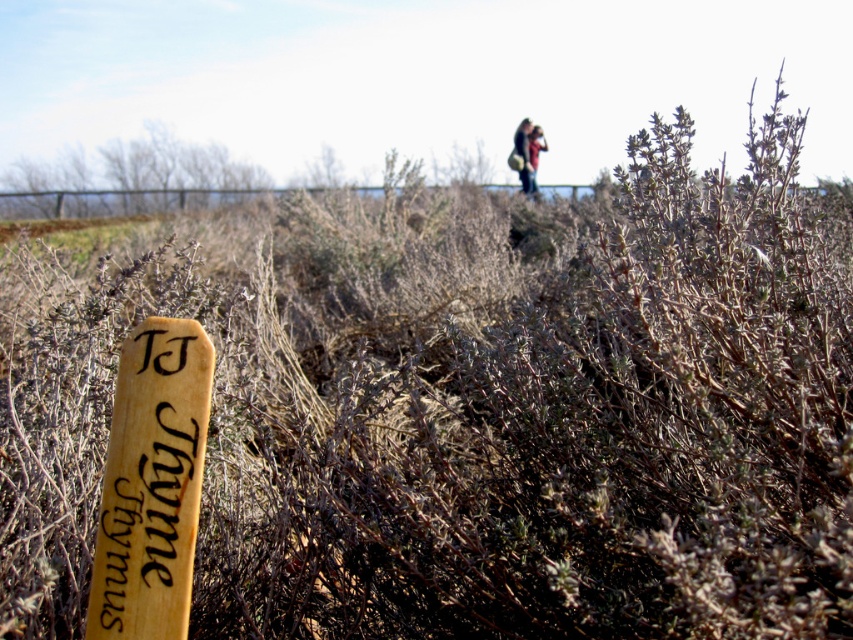
Which is below, dark brown leather jacket at upper center or brown leather jacket at upper center?

Positioned lower is brown leather jacket at upper center.

Who is higher up, dark brown leather jacket at upper center or brown leather jacket at upper center?

Positioned higher is dark brown leather jacket at upper center.

Find the location of a particular element. The height and width of the screenshot is (640, 853). dark brown leather jacket at upper center is located at coordinates (521, 156).

This screenshot has width=853, height=640. What are the coordinates of `dark brown leather jacket at upper center` in the screenshot? It's located at (521, 156).